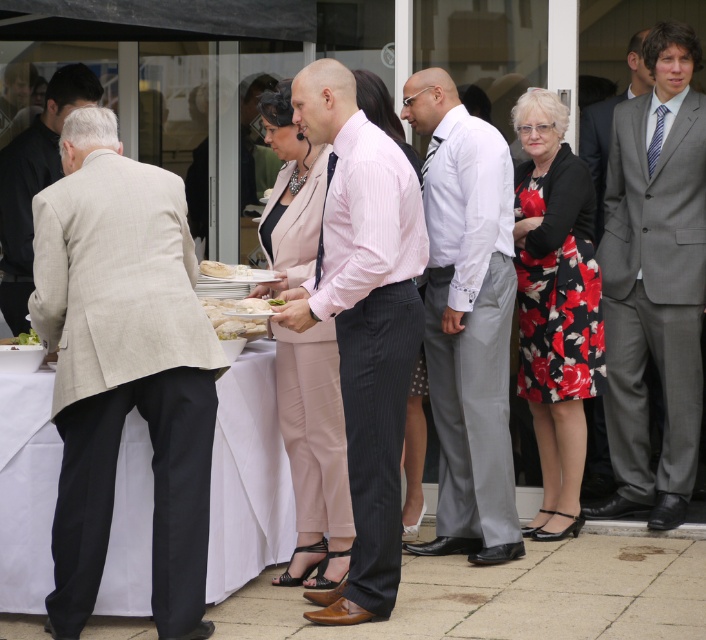
Question: Is matte pink suit at center smaller than beige linen suit at left?

Choices:
 (A) yes
 (B) no

Answer: (B)

Question: Which point is closer to the camera?

Choices:
 (A) (65, 320)
 (B) (554, 512)

Answer: (A)

Question: Which of the following is the closest to the observer?

Choices:
 (A) (426, 336)
 (B) (409, 500)
 (C) (311, 109)
 (D) (333, 417)

Answer: (C)

Question: Is white linen table at lower left to the right of beige linen suit at left from the viewer's perspective?

Choices:
 (A) yes
 (B) no

Answer: (A)

Question: Which object appears closest to the camera in this image?

Choices:
 (A) white linen table at lower left
 (B) pink fabric dress at center

Answer: (A)

Question: Is floral dress at center smaller than pink fabric dress at center?

Choices:
 (A) no
 (B) yes

Answer: (A)